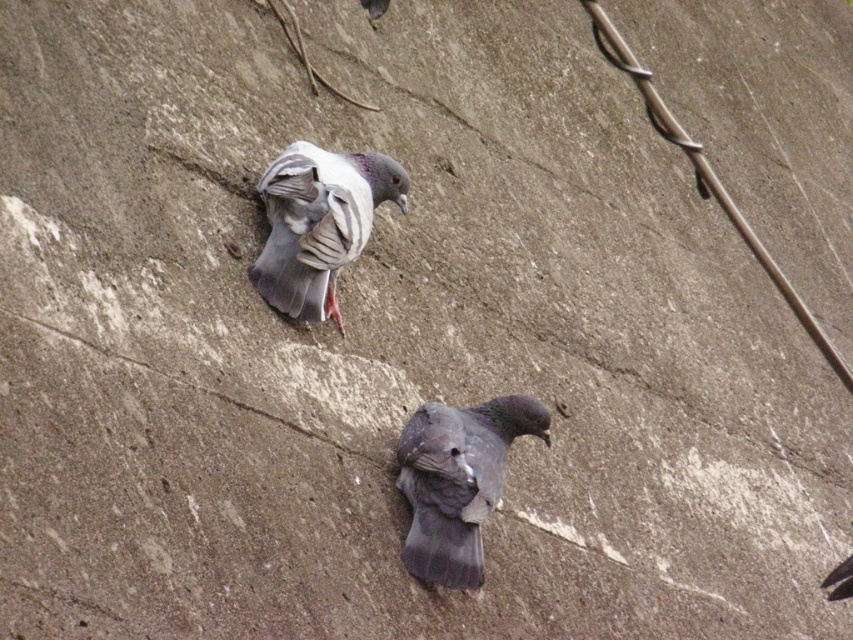
Question: Does gray matte pigeon at center have a lesser width compared to gray matte pigeon at upper center?

Choices:
 (A) yes
 (B) no

Answer: (A)

Question: Does gray matte pigeon at center have a lesser width compared to gray matte pigeon at upper center?

Choices:
 (A) no
 (B) yes

Answer: (B)

Question: Among these points, which one is farthest from the camera?

Choices:
 (A) (305, 196)
 (B) (469, 484)

Answer: (A)

Question: Among these points, which one is farthest from the camera?

Choices:
 (A) (331, 291)
 (B) (469, 577)

Answer: (A)

Question: Does gray matte pigeon at center appear under gray matte pigeon at upper center?

Choices:
 (A) yes
 (B) no

Answer: (A)